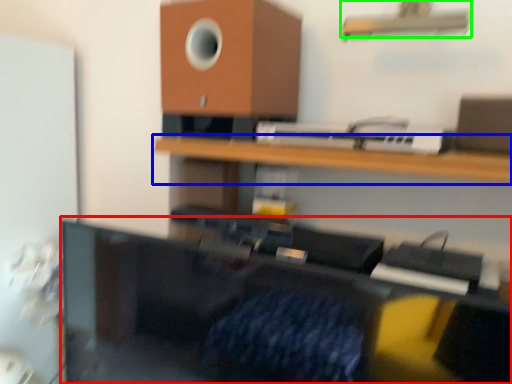
Question: Which is farther away from furniture (highlighted by a red box)? shelf (highlighted by a blue box) or shelf (highlighted by a green box)?

Choices:
 (A) shelf
 (B) shelf

Answer: (B)